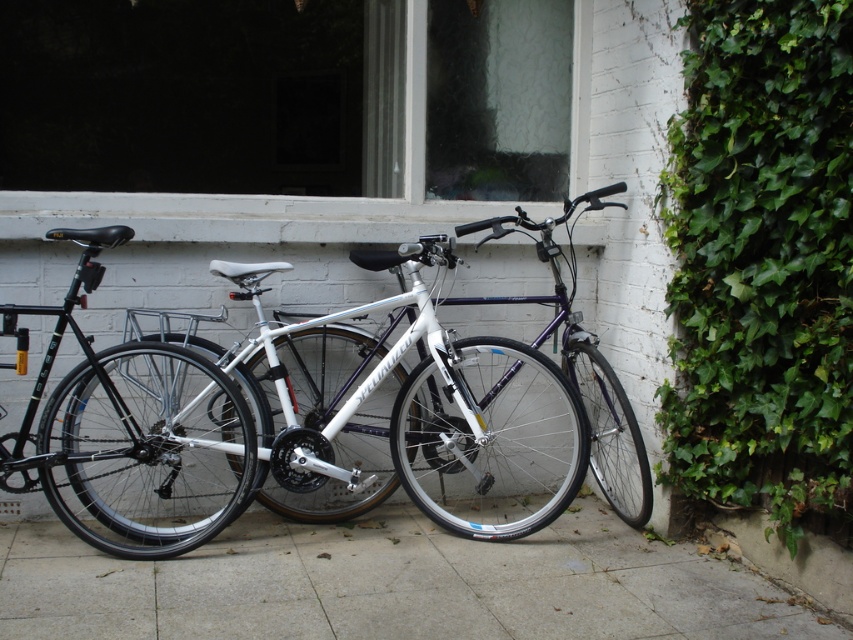
Does white matte bicycle at center have a smaller size compared to shiny silver bicycle at left?

Actually, white matte bicycle at center might be larger than shiny silver bicycle at left.

Based on the photo, between white matte bicycle at center and shiny silver bicycle at left, which one is positioned higher?

shiny silver bicycle at left is higher up.

Describe the element at coordinates (334, 426) in the screenshot. I see `white matte bicycle at center` at that location.

Find the location of a particular element. This screenshot has height=640, width=853. white matte bicycle at center is located at coordinates pos(334,426).

Describe the element at coordinates (393, 584) in the screenshot. The height and width of the screenshot is (640, 853). I see `gray concrete pavement at center` at that location.

Who is lower down, gray concrete pavement at center or white matte bicycle at center?

gray concrete pavement at center is lower down.

What do you see at coordinates (393, 584) in the screenshot? The image size is (853, 640). I see `gray concrete pavement at center` at bounding box center [393, 584].

In order to click on gray concrete pavement at center in this screenshot , I will do `click(393, 584)`.

Does green leafy ivy at right have a greater height compared to shiny silver bicycle at left?

Yes, green leafy ivy at right is taller than shiny silver bicycle at left.

Is point (764, 150) behind point (120, 380)?

That is False.

The height and width of the screenshot is (640, 853). Find the location of `green leafy ivy at right`. green leafy ivy at right is located at coordinates (761, 260).